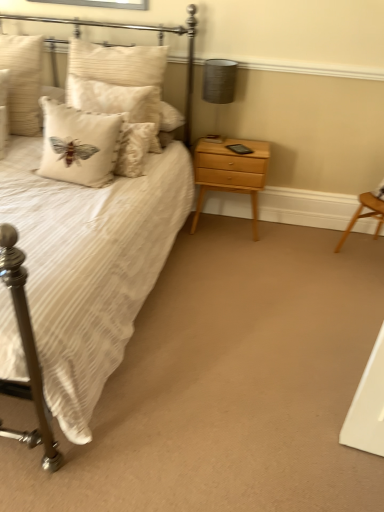
Question: Can white striped fabric bed at left be found inside beige textured pillow at upper left, placed as the first pillow when sorted from left to right?

Choices:
 (A) no
 (B) yes

Answer: (A)

Question: From a real-world perspective, is beige textured pillow at upper left, the third pillow from the right, located higher than white striped fabric bed at left?

Choices:
 (A) yes
 (B) no

Answer: (A)

Question: Are beige textured pillow at upper left, the third pillow from the right, and white striped fabric bed at left far apart?

Choices:
 (A) yes
 (B) no

Answer: (B)

Question: Considering the relative sizes of beige textured pillow at upper left, the third pillow from the right, and white striped fabric bed at left in the image provided, is beige textured pillow at upper left, the third pillow from the right, wider than white striped fabric bed at left?

Choices:
 (A) yes
 (B) no

Answer: (B)

Question: Does beige textured pillow at upper left, placed as the first pillow when sorted from left to right, appear on the right side of white striped fabric bed at left?

Choices:
 (A) no
 (B) yes

Answer: (A)

Question: Considering the positions of white striped fabric bed at left and light wood/texture nightstand at right in the image, is white striped fabric bed at left taller or shorter than light wood/texture nightstand at right?

Choices:
 (A) tall
 (B) short

Answer: (A)

Question: From the image's perspective, relative to light wood/texture nightstand at right, is white striped fabric bed at left above or below?

Choices:
 (A) above
 (B) below

Answer: (A)

Question: Looking at the image, does white striped fabric bed at left seem bigger or smaller compared to light wood/texture nightstand at right?

Choices:
 (A) small
 (B) big

Answer: (B)

Question: Is white striped fabric bed at left to the left or to the right of light wood/texture nightstand at right in the image?

Choices:
 (A) right
 (B) left

Answer: (B)

Question: From the image's perspective, is white striped fabric bed at left above or below white textured cushion at upper left, arranged as the 2th pillow when viewed from the left?

Choices:
 (A) below
 (B) above

Answer: (A)

Question: From their relative heights in the image, would you say white striped fabric bed at left is taller or shorter than white textured cushion at upper left, arranged as the 2th pillow when viewed from the left?

Choices:
 (A) tall
 (B) short

Answer: (A)

Question: Is white striped fabric bed at left wider or thinner than white textured cushion at upper left, which appears as the second pillow when viewed from the right?

Choices:
 (A) wide
 (B) thin

Answer: (A)

Question: Is white striped fabric bed at left inside the boundaries of white textured cushion at upper left, which appears as the second pillow when viewed from the right, or outside?

Choices:
 (A) outside
 (B) inside

Answer: (A)

Question: From a real-world perspective, is matte gray lampshade at upper right above or below white textured cushion at upper left, arranged as the 2th pillow when viewed from the left?

Choices:
 (A) above
 (B) below

Answer: (A)

Question: Is matte gray lampshade at upper right to the left or to the right of white textured cushion at upper left, arranged as the 2th pillow when viewed from the left, in the image?

Choices:
 (A) left
 (B) right

Answer: (B)